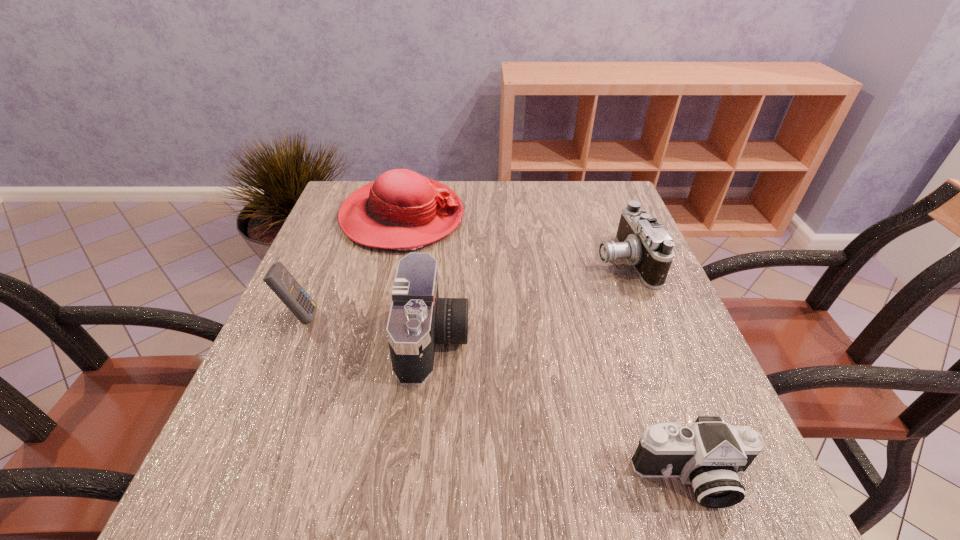
Image resolution: width=960 pixels, height=540 pixels. Find the location of `free spot between the farthest camera and the hat`. free spot between the farthest camera and the hat is located at coordinates (513, 239).

Where is `vacant space in between the calculator and the hat`? vacant space in between the calculator and the hat is located at coordinates (351, 266).

The width and height of the screenshot is (960, 540). I want to click on free space between the farthest camera and the nearest object, so click(658, 369).

This screenshot has height=540, width=960. Identify the location of vacant space that's between the farthest camera and the hat. (513, 239).

The width and height of the screenshot is (960, 540). I want to click on object that is the closest to the hat, so click(x=418, y=320).

Select which object appears as the closest to the second farthest camera. Please provide its 2D coordinates. Your answer should be formatted as a tuple, i.e. [(x, y)], where the tuple contains the x and y coordinates of a point satisfying the conditions above.

[(402, 210)]

Identify the location of camera that is the closest to the leftmost camera. Image resolution: width=960 pixels, height=540 pixels. (710, 455).

Choose which camera is the second nearest neighbor to the hat. Please provide its 2D coordinates. Your answer should be formatted as a tuple, i.e. [(x, y)], where the tuple contains the x and y coordinates of a point satisfying the conditions above.

[(641, 240)]

This screenshot has height=540, width=960. I want to click on vacant space that satisfies the following two spatial constraints: 1. on the front-facing side of the nearest object; 2. on the right side of the calculator, so click(231, 478).

This screenshot has width=960, height=540. Find the location of `vacant area that satisfies the following two spatial constraints: 1. at the front of the nearest camera with a bow; 2. on the left side of the hat`. vacant area that satisfies the following two spatial constraints: 1. at the front of the nearest camera with a bow; 2. on the left side of the hat is located at coordinates click(x=340, y=478).